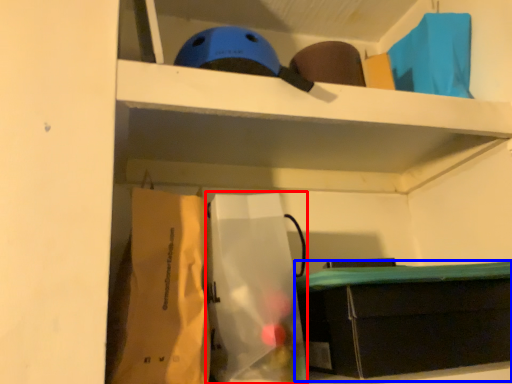
Question: Which point is closer to the camera, paper bag (highlighted by a red box) or furniture (highlighted by a blue box)?

Choices:
 (A) paper bag
 (B) furniture

Answer: (A)